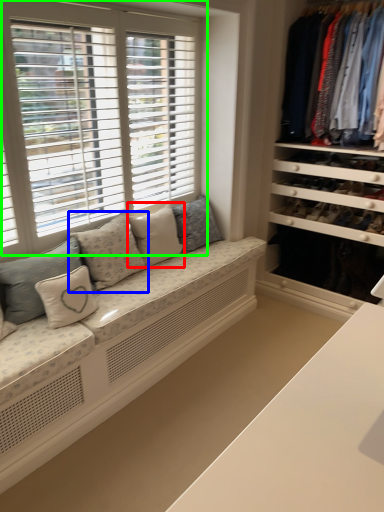
Question: Considering the real-world distances, which object is closest to pillow (highlighted by a red box)? pillow (highlighted by a blue box) or window (highlighted by a green box).

Choices:
 (A) pillow
 (B) window

Answer: (A)